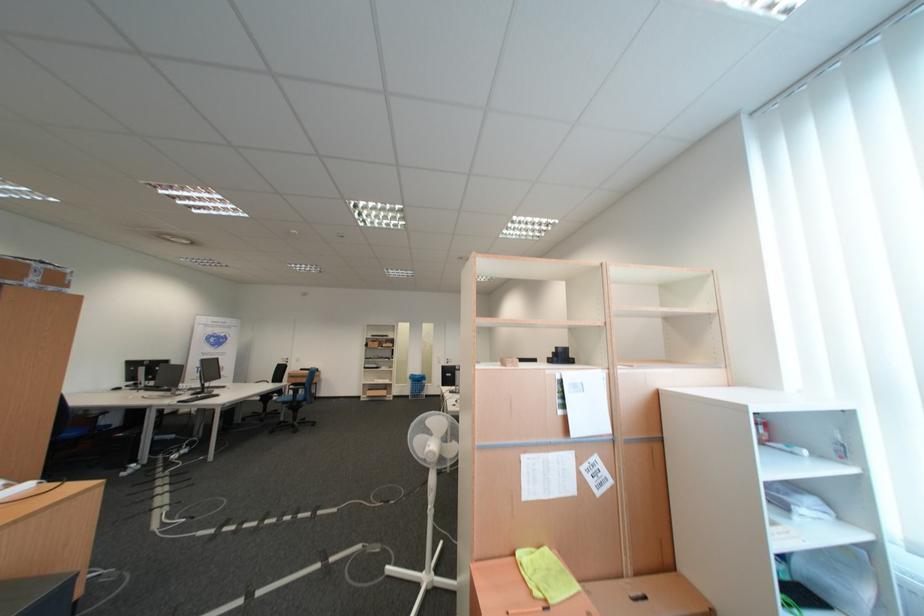
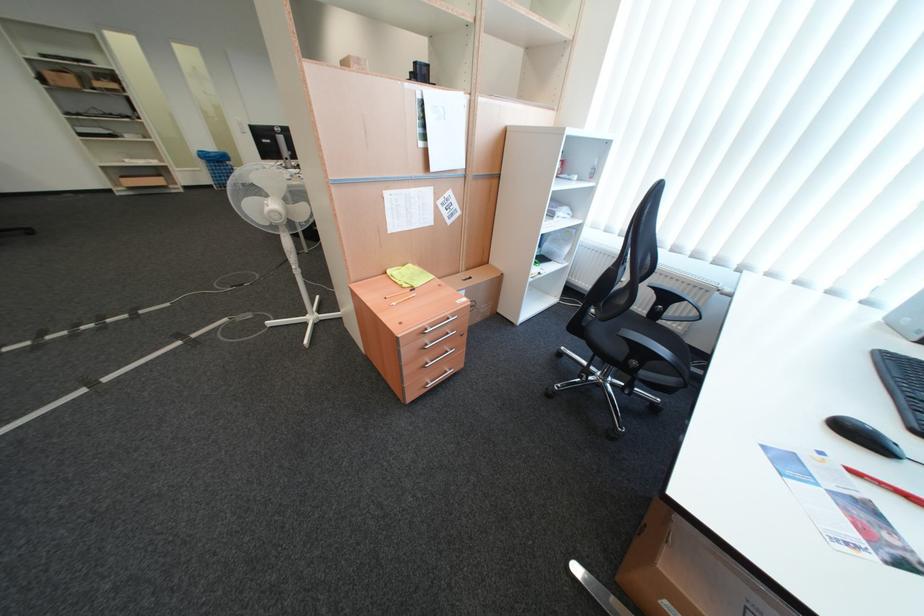
Find the pixel in the second image that matches (526,556) in the first image.

(397, 274)